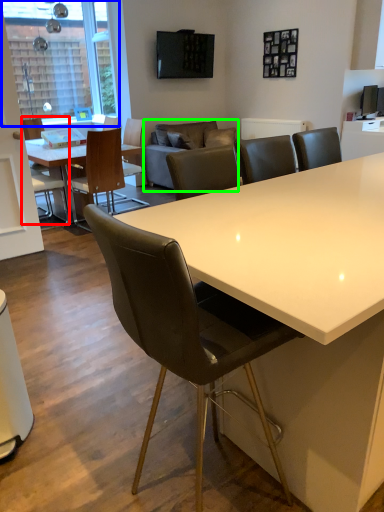
Question: Based on their relative distances, which object is farther from chair (highlighted by a red box)? Choose from window screen (highlighted by a blue box) and couch (highlighted by a green box).

Choices:
 (A) window screen
 (B) couch

Answer: (B)